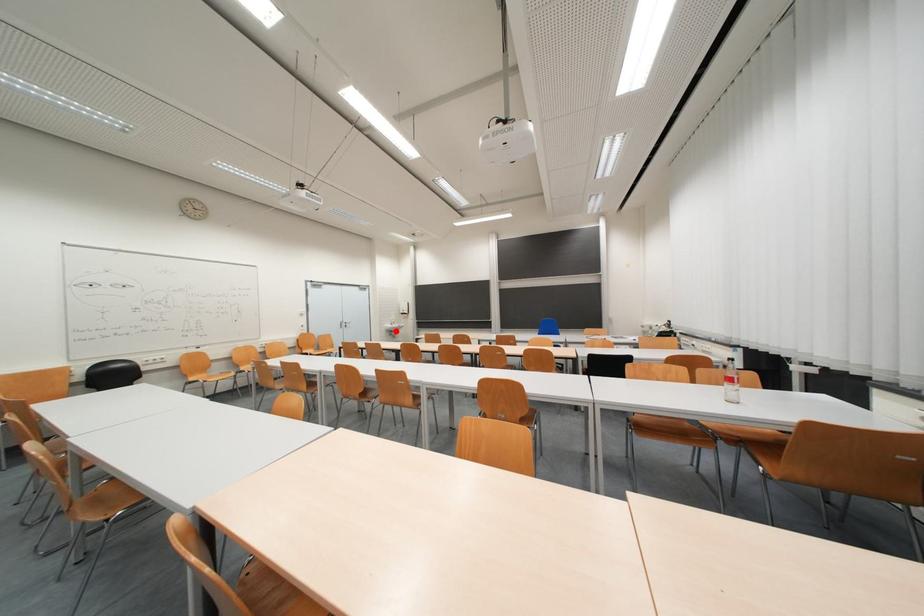
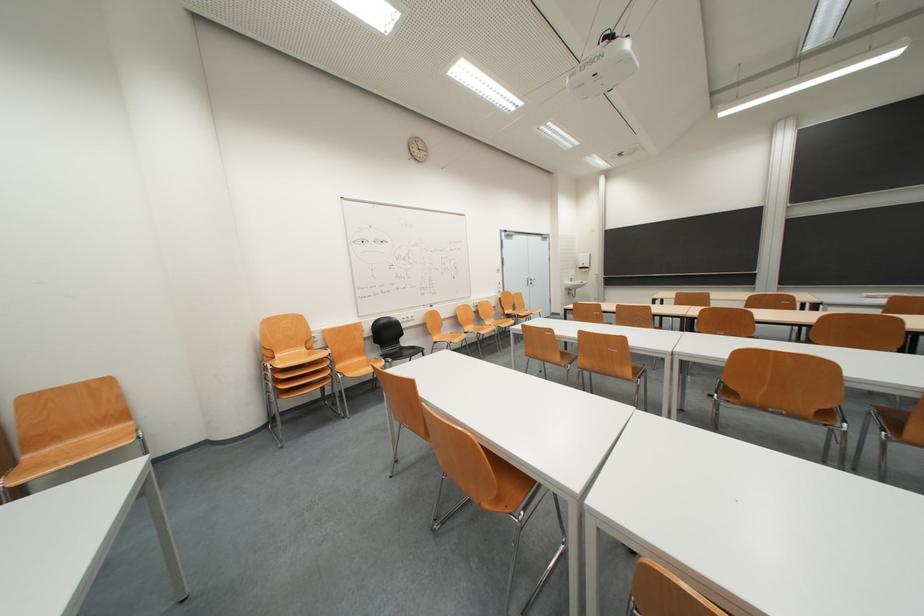
The point at the highlighted location is marked in the first image. Where is the corresponding point in the second image?

(575, 288)